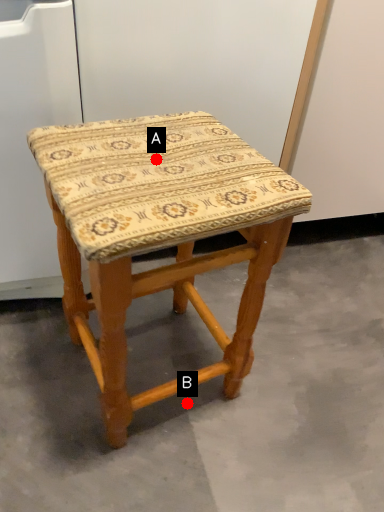
Question: Two points are circled on the image, labeled by A and B beside each circle. Which point appears farthest from the camera in this image?

Choices:
 (A) A is further
 (B) B is further

Answer: (B)